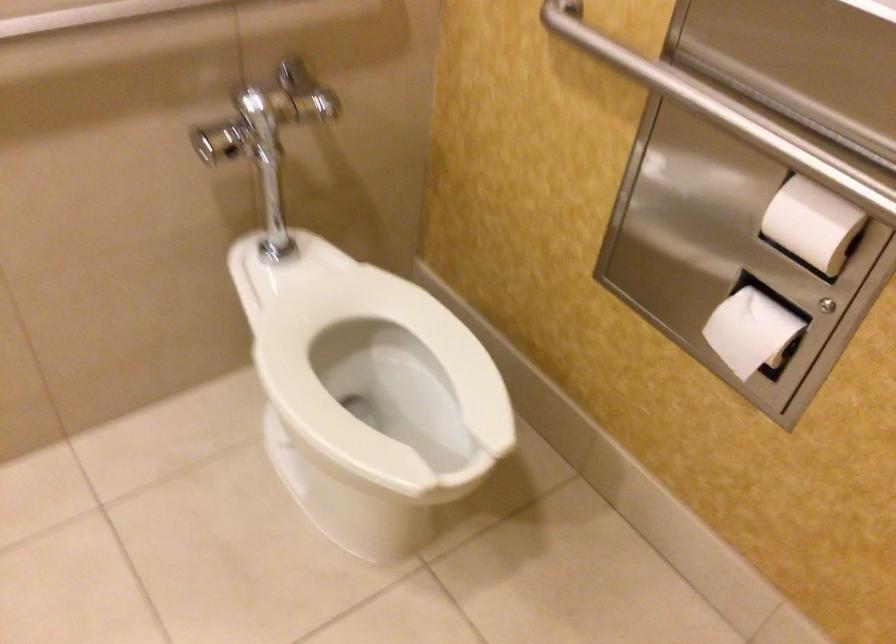
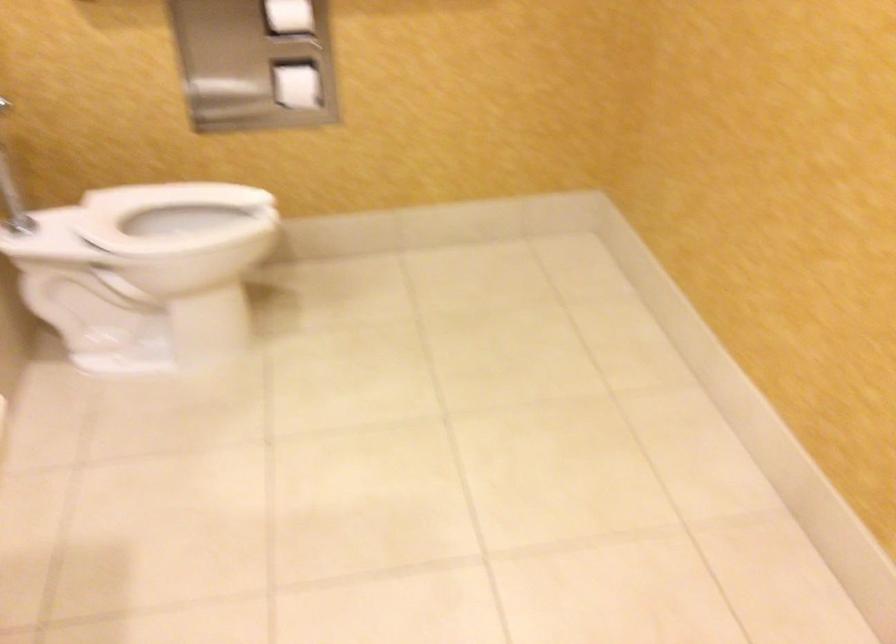
Find the pixel in the second image that matches the point at 785,218 in the first image.

(289, 15)